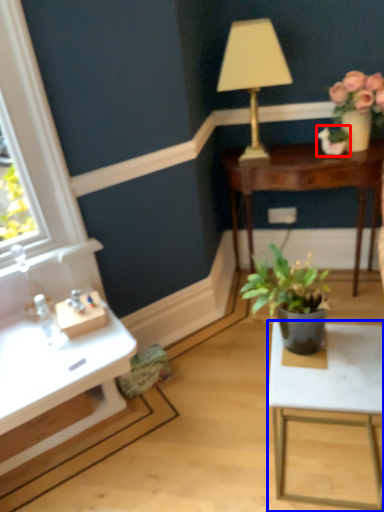
Question: Which object is further to the camera taking this photo, houseplant (highlighted by a red box) or table (highlighted by a blue box)?

Choices:
 (A) houseplant
 (B) table

Answer: (A)